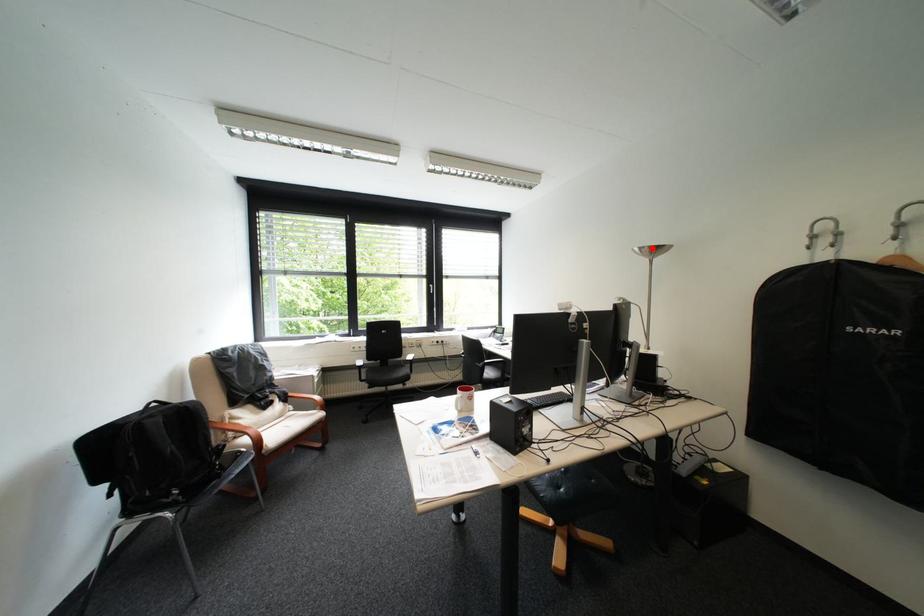
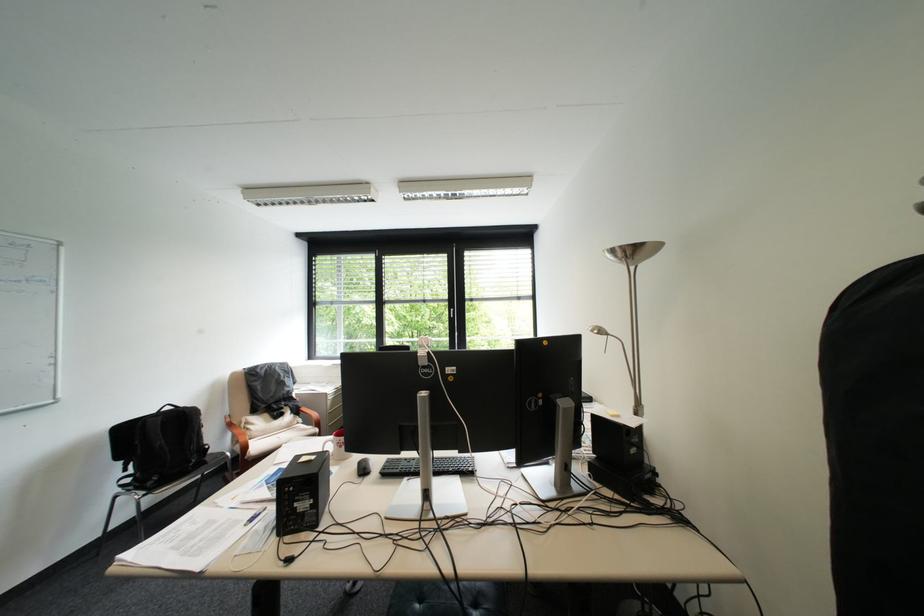
Locate, in the second image, the point that corresponds to the highlighted location in the first image.

(625, 252)